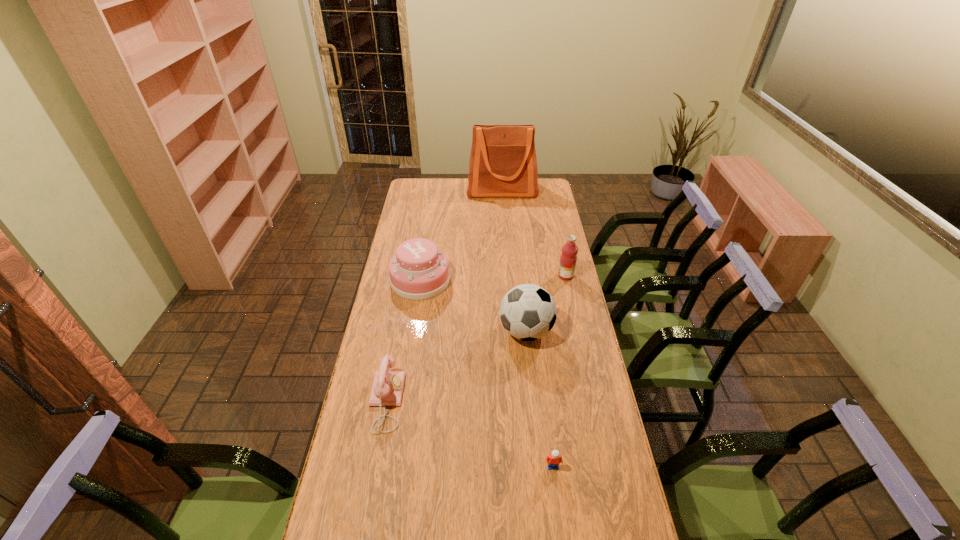
Where is `birthday cake located in the left edge section of the desktop`? birthday cake located in the left edge section of the desktop is located at coordinates (418, 271).

Locate an element on the screen. This screenshot has height=540, width=960. telephone that is at the left edge is located at coordinates [x=387, y=388].

This screenshot has height=540, width=960. In order to click on shopping bag located in the right edge section of the desktop in this screenshot , I will do `click(503, 163)`.

You are a GUI agent. You are given a task and a screenshot of the screen. Output one action in this format:
    pyautogui.click(x=<x>, y=<y>)
    Task: Click on the soccer ball that is at the right edge
    The height and width of the screenshot is (540, 960).
    Given the screenshot: What is the action you would take?
    pyautogui.click(x=528, y=312)

Where is `fruit juice that is at the right edge`? fruit juice that is at the right edge is located at coordinates (568, 258).

Locate an element on the screen. object at the far right corner is located at coordinates tap(503, 163).

The height and width of the screenshot is (540, 960). In the image, there is a desktop. Identify the location of free space at the far edge. (467, 197).

The image size is (960, 540). Identify the location of vacant area at the left edge. (414, 206).

In the image, there is a desktop. Identify the location of vacant space at the right edge. The width and height of the screenshot is (960, 540). (539, 282).

At what (x,y) coordinates should I click in order to perform the action: click on vacant space in between the second shortest object and the birthday cake. Please return your answer as a coordinate pair (x, y). Looking at the image, I should click on (403, 341).